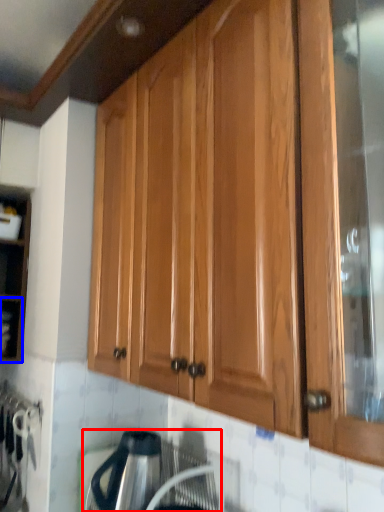
Question: Which object is further to the camera taking this photo, appliance (highlighted by a red box) or shelf (highlighted by a blue box)?

Choices:
 (A) appliance
 (B) shelf

Answer: (B)